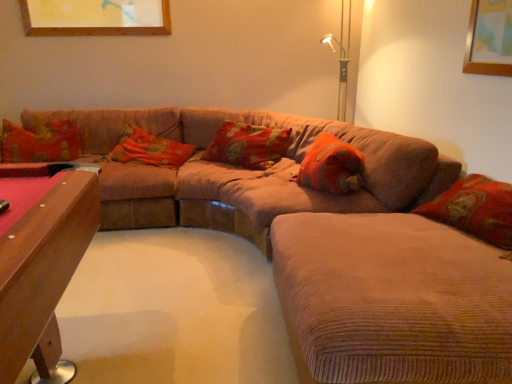
What do you see at coordinates (150, 149) in the screenshot?
I see `floral fabric pillow at center, which is the second pillow from left to right` at bounding box center [150, 149].

How much space does floral fabric pillow at center, arranged as the third pillow when viewed from the right, occupy horizontally?

The width of floral fabric pillow at center, arranged as the third pillow when viewed from the right, is 55.55 centimeters.

Measure the distance between point (400,333) and camera.

A distance of 4.07 feet exists between point (400,333) and camera.

The image size is (512, 384). What do you see at coordinates (247, 145) in the screenshot? I see `corduroy textured pillow at center, which appears as the 2th pillow when viewed from the right` at bounding box center [247, 145].

You are a GUI agent. You are given a task and a screenshot of the screen. Output one action in this format:
    pyautogui.click(x=<x>, y=<y>)
    Task: Click on the fluffy orange pillow at center, marked as the fourth pillow in a left-to-right arrangement
    
    Given the screenshot: What is the action you would take?
    pyautogui.click(x=331, y=166)

Is fluffy orange pillow at center, the 1th pillow in the right-to-left sequence, oriented towards corduroy couch at center?

Yes, fluffy orange pillow at center, the 1th pillow in the right-to-left sequence, is turned towards corduroy couch at center.

How much distance is there between fluffy orange pillow at center, the 1th pillow in the right-to-left sequence, and corduroy couch at center?

fluffy orange pillow at center, the 1th pillow in the right-to-left sequence, is 14.88 inches from corduroy couch at center.

Can you confirm if fluffy orange pillow at center, the 1th pillow in the right-to-left sequence, is bigger than corduroy couch at center?

No.

From the image's perspective, is fluffy orange pillow at center, marked as the fourth pillow in a left-to-right arrangement, beneath corduroy couch at center?

Actually, fluffy orange pillow at center, marked as the fourth pillow in a left-to-right arrangement, appears above corduroy couch at center in the image.

Between corduroy couch at lower right and corduroy textured pillow at center, which appears as the 2th pillow when viewed from the right, which one appears on the left side from the viewer's perspective?

corduroy textured pillow at center, which appears as the 2th pillow when viewed from the right.

This screenshot has width=512, height=384. I want to click on pillow that is the 3rd one above the corduroy couch at lower right (from a real-world perspective), so click(247, 145).

Is corduroy couch at lower right wider or thinner than corduroy textured pillow at center, the 3th pillow when ordered from left to right?

corduroy couch at lower right is wider than corduroy textured pillow at center, the 3th pillow when ordered from left to right.

Is corduroy couch at lower right bigger than corduroy textured pillow at center, which appears as the 2th pillow when viewed from the right?

Indeed, corduroy couch at lower right has a larger size compared to corduroy textured pillow at center, which appears as the 2th pillow when viewed from the right.

Is floral fabric pillow at left, the 1th pillow when ordered from left to right, positioned far away from corduroy couch at lower right?

Yes.

Considering the relative sizes of floral fabric pillow at left, marked as the 4th pillow in a right-to-left arrangement, and corduroy couch at lower right in the image provided, is floral fabric pillow at left, marked as the 4th pillow in a right-to-left arrangement, taller than corduroy couch at lower right?

Correct, floral fabric pillow at left, marked as the 4th pillow in a right-to-left arrangement, is much taller as corduroy couch at lower right.

Is point (76, 127) closer or farther from the camera than point (505, 365)?

Point (76, 127).

Is floral fabric pillow at left, the 1th pillow when ordered from left to right, smaller than corduroy couch at lower right?

Yes.

Considering the positions of objects corduroy couch at lower right and floral fabric pillow at left, marked as the 4th pillow in a right-to-left arrangement, in the image provided, who is more to the left, corduroy couch at lower right or floral fabric pillow at left, marked as the 4th pillow in a right-to-left arrangement,?

From the viewer's perspective, floral fabric pillow at left, marked as the 4th pillow in a right-to-left arrangement, appears more on the left side.

Which is closer to the camera, (373, 331) or (48, 152)?

Clearly, point (373, 331) is closer to the camera than point (48, 152).

Can you confirm if fluffy orange pillow at center, the 1th pillow in the right-to-left sequence, is shorter than floral fabric pillow at left, the 1th pillow when ordered from left to right?

Correct, fluffy orange pillow at center, the 1th pillow in the right-to-left sequence, is not as tall as floral fabric pillow at left, the 1th pillow when ordered from left to right.

This screenshot has width=512, height=384. Identify the location of the 2nd pillow directly above the fluffy orange pillow at center, marked as the fourth pillow in a left-to-right arrangement (from a real-world perspective). (41, 142).

Looking at this image, from a real-world perspective, is fluffy orange pillow at center, marked as the fourth pillow in a left-to-right arrangement, on top of floral fabric pillow at left, marked as the 4th pillow in a right-to-left arrangement?

Incorrect, from a real-world perspective, fluffy orange pillow at center, marked as the fourth pillow in a left-to-right arrangement, is lower than floral fabric pillow at left, marked as the 4th pillow in a right-to-left arrangement.

Between corduroy couch at center and corduroy couch at lower right, which one is positioned behind?

corduroy couch at center is behind.

Are corduroy couch at center and corduroy couch at lower right located far from each other?

Actually, corduroy couch at center and corduroy couch at lower right are a little close together.

Is corduroy couch at center taller or shorter than corduroy couch at lower right?

In the image, corduroy couch at center appears to be taller than corduroy couch at lower right.

Is floral fabric pillow at left, the 1th pillow when ordered from left to right, oriented away from corduroy textured pillow at center, the 3th pillow when ordered from left to right?

No, floral fabric pillow at left, the 1th pillow when ordered from left to right,'s orientation is not away from corduroy textured pillow at center, the 3th pillow when ordered from left to right.

The width and height of the screenshot is (512, 384). I want to click on pillow above the corduroy textured pillow at center, the 3th pillow when ordered from left to right (from the image's perspective), so click(41, 142).

Between floral fabric pillow at left, the 1th pillow when ordered from left to right, and corduroy textured pillow at center, the 3th pillow when ordered from left to right, which one has more height?

floral fabric pillow at left, the 1th pillow when ordered from left to right.

Locate an element on the screen. This screenshot has height=384, width=512. studio couch in front of the fluffy orange pillow at center, marked as the fourth pillow in a left-to-right arrangement is located at coordinates (275, 191).

Where is `the 3rd pillow behind the corduroy couch at lower right, starting your count from the anchor`? The height and width of the screenshot is (384, 512). the 3rd pillow behind the corduroy couch at lower right, starting your count from the anchor is located at coordinates (247, 145).

Based on the photo, when comparing their distances from fluffy orange pillow at center, marked as the fourth pillow in a left-to-right arrangement, does floral fabric pillow at left, marked as the 4th pillow in a right-to-left arrangement, or corduroy textured pillow at center, which appears as the 2th pillow when viewed from the right, seem further?

Based on the image, floral fabric pillow at left, marked as the 4th pillow in a right-to-left arrangement, appears to be further to fluffy orange pillow at center, marked as the fourth pillow in a left-to-right arrangement.

Looking at the image, which one is located closer to corduroy couch at center, floral fabric pillow at center, which is the second pillow from left to right, or corduroy textured pillow at center, which appears as the 2th pillow when viewed from the right?

Among the two, corduroy textured pillow at center, which appears as the 2th pillow when viewed from the right, is located nearer to corduroy couch at center.

Based on their spatial positions, is floral fabric pillow at center, arranged as the third pillow when viewed from the right, or corduroy couch at lower right closer to floral fabric pillow at left, the 1th pillow when ordered from left to right?

The object closer to floral fabric pillow at left, the 1th pillow when ordered from left to right, is floral fabric pillow at center, arranged as the third pillow when viewed from the right.

When comparing their distances from corduroy couch at center, does corduroy textured pillow at center, the 3th pillow when ordered from left to right, or floral fabric pillow at center, arranged as the third pillow when viewed from the right, seem closer?

corduroy textured pillow at center, the 3th pillow when ordered from left to right, lies closer to corduroy couch at center than the other object.

Which object lies nearer to the anchor point fluffy orange pillow at center, marked as the fourth pillow in a left-to-right arrangement, corduroy couch at lower right or floral fabric pillow at left, the 1th pillow when ordered from left to right?

Among the two, corduroy couch at lower right is located nearer to fluffy orange pillow at center, marked as the fourth pillow in a left-to-right arrangement.

Estimate the real-world distances between objects in this image. Which object is further from corduroy couch at lower right, corduroy couch at center or corduroy textured pillow at center, which appears as the 2th pillow when viewed from the right?

The object further to corduroy couch at lower right is corduroy textured pillow at center, which appears as the 2th pillow when viewed from the right.

Estimate the real-world distances between objects in this image. Which object is further from corduroy couch at center, corduroy couch at lower right or fluffy orange pillow at center, marked as the fourth pillow in a left-to-right arrangement?

fluffy orange pillow at center, marked as the fourth pillow in a left-to-right arrangement, is further to corduroy couch at center.

When comparing their distances from corduroy textured pillow at center, the 3th pillow when ordered from left to right, does corduroy couch at lower right or corduroy couch at center seem closer?

corduroy couch at center lies closer to corduroy textured pillow at center, the 3th pillow when ordered from left to right, than the other object.

Find the location of a particular element. The width and height of the screenshot is (512, 384). pillow between floral fabric pillow at left, marked as the 4th pillow in a right-to-left arrangement, and corduroy textured pillow at center, the 3th pillow when ordered from left to right, from left to right is located at coordinates (x=150, y=149).

The image size is (512, 384). I want to click on studio couch situated between floral fabric pillow at left, the 1th pillow when ordered from left to right, and corduroy couch at lower right from left to right, so click(x=275, y=191).

You are a GUI agent. You are given a task and a screenshot of the screen. Output one action in this format:
    pyautogui.click(x=<x>, y=<y>)
    Task: Click on the studio couch between floral fabric pillow at center, which is the second pillow from left to right, and fluffy orange pillow at center, marked as the fourth pillow in a left-to-right arrangement, in the horizontal direction
    
    Given the screenshot: What is the action you would take?
    pyautogui.click(x=275, y=191)

The height and width of the screenshot is (384, 512). Identify the location of pillow between floral fabric pillow at center, arranged as the third pillow when viewed from the right, and fluffy orange pillow at center, the 1th pillow in the right-to-left sequence. (247, 145).